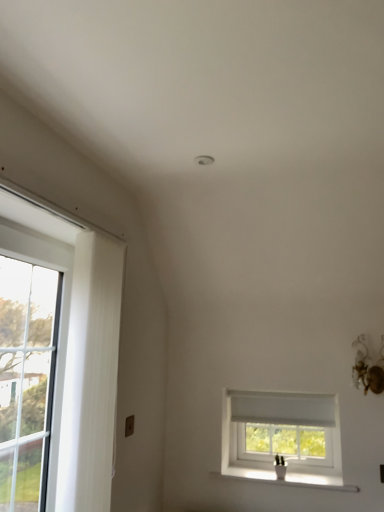
Question: Can you confirm if clear glass door at left is thinner than white textured curtain at left?

Choices:
 (A) yes
 (B) no

Answer: (B)

Question: From a real-world perspective, does clear glass door at left stand above white textured curtain at left?

Choices:
 (A) yes
 (B) no

Answer: (B)

Question: Is clear glass door at left taller than white textured curtain at left?

Choices:
 (A) yes
 (B) no

Answer: (B)

Question: Is clear glass door at left next to white textured curtain at left?

Choices:
 (A) yes
 (B) no

Answer: (B)

Question: Is clear glass door at left outside white textured curtain at left?

Choices:
 (A) yes
 (B) no

Answer: (A)

Question: Considering the positions of white ceramic vase at lower right and clear glass door at left in the image, is white ceramic vase at lower right wider or thinner than clear glass door at left?

Choices:
 (A) wide
 (B) thin

Answer: (A)

Question: Is point (304, 478) positioned closer to the camera than point (6, 509)?

Choices:
 (A) farther
 (B) closer

Answer: (A)

Question: Looking at the image, does white ceramic vase at lower right seem bigger or smaller compared to clear glass door at left?

Choices:
 (A) big
 (B) small

Answer: (B)

Question: From a real-world perspective, is white ceramic vase at lower right above or below clear glass door at left?

Choices:
 (A) below
 (B) above

Answer: (A)

Question: Is point pyautogui.click(x=3, y=373) closer or farther from the camera than point pyautogui.click(x=102, y=448)?

Choices:
 (A) closer
 (B) farther

Answer: (B)

Question: Based on their positions, is clear glass door at left located to the left or right of white textured curtain at left?

Choices:
 (A) left
 (B) right

Answer: (A)

Question: Based on their sizes in the image, would you say clear glass door at left is bigger or smaller than white textured curtain at left?

Choices:
 (A) small
 (B) big

Answer: (B)

Question: In terms of height, does clear glass door at left look taller or shorter compared to white textured curtain at left?

Choices:
 (A) tall
 (B) short

Answer: (B)

Question: Is white plastic window at center inside or outside of white ceramic vase at lower right?

Choices:
 (A) inside
 (B) outside

Answer: (B)

Question: From a real-world perspective, is white plastic window at center above or below white ceramic vase at lower right?

Choices:
 (A) below
 (B) above

Answer: (B)